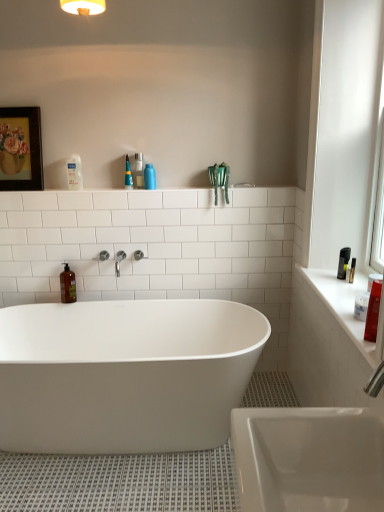
Locate an element on the screen. The image size is (384, 512). free location to the right of clear plastic bottle at upper left, which appears as the first toiletry when viewed from the left is located at coordinates (108, 187).